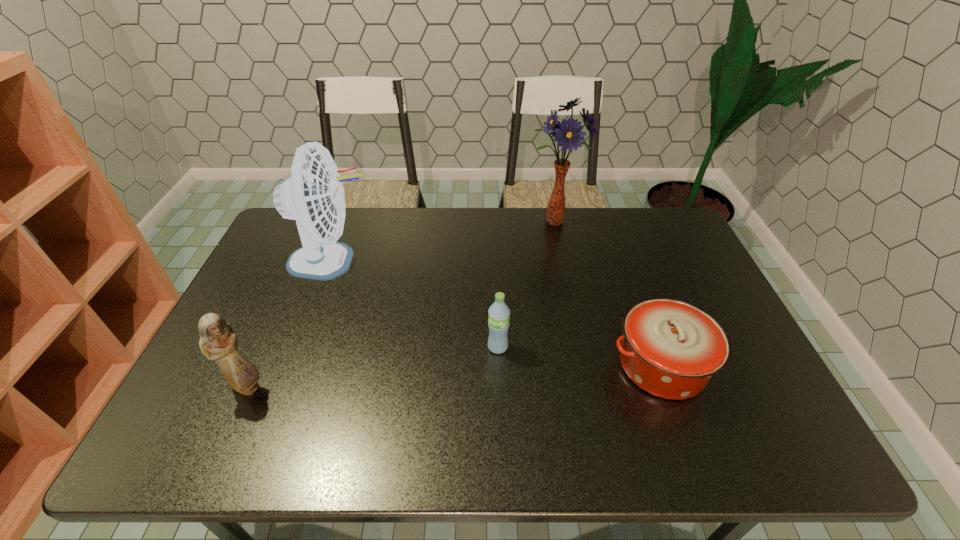
Find the location of a particular element. free space between the fan and the fourth tallest object is located at coordinates (415, 304).

Where is `free space between the fourth tallest object and the third shortest object`? The height and width of the screenshot is (540, 960). free space between the fourth tallest object and the third shortest object is located at coordinates (372, 367).

The image size is (960, 540). Identify the location of vacant space in between the fan and the fourth tallest object. (415, 304).

Image resolution: width=960 pixels, height=540 pixels. In order to click on empty space between the farthest object and the second farthest object in this screenshot , I will do `click(444, 242)`.

I want to click on unoccupied position between the water bottle and the third tallest object, so click(372, 367).

I want to click on empty space between the farthest object and the figurine, so pos(401,305).

Image resolution: width=960 pixels, height=540 pixels. I want to click on free space between the shortest object and the figurine, so click(455, 376).

Locate an element on the screen. empty space that is in between the fourth nearest object and the water bottle is located at coordinates (415, 304).

Locate an element on the screen. object that is the fourth closest to the farthest object is located at coordinates (218, 341).

Select which object appears as the fourth closest to the casserole. Please provide its 2D coordinates. Your answer should be formatted as a tuple, i.e. [(x, y)], where the tuple contains the x and y coordinates of a point satisfying the conditions above.

[(218, 341)]